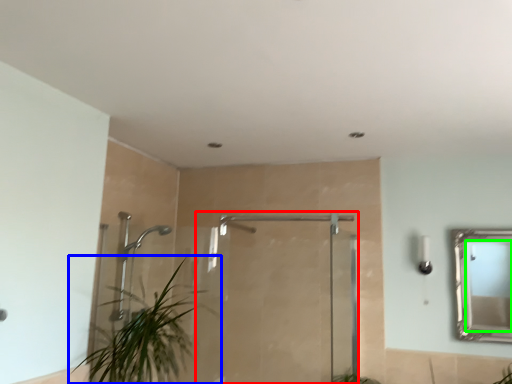
Question: Considering the real-world distances, which object is closest to screen door (highlighted by a red box)? houseplant (highlighted by a blue box) or mirror (highlighted by a green box).

Choices:
 (A) houseplant
 (B) mirror

Answer: (A)